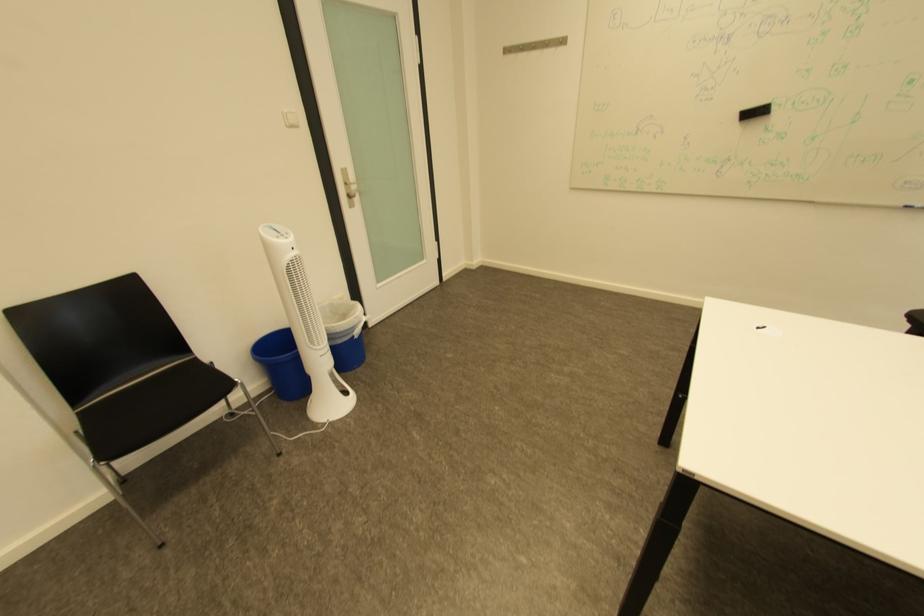
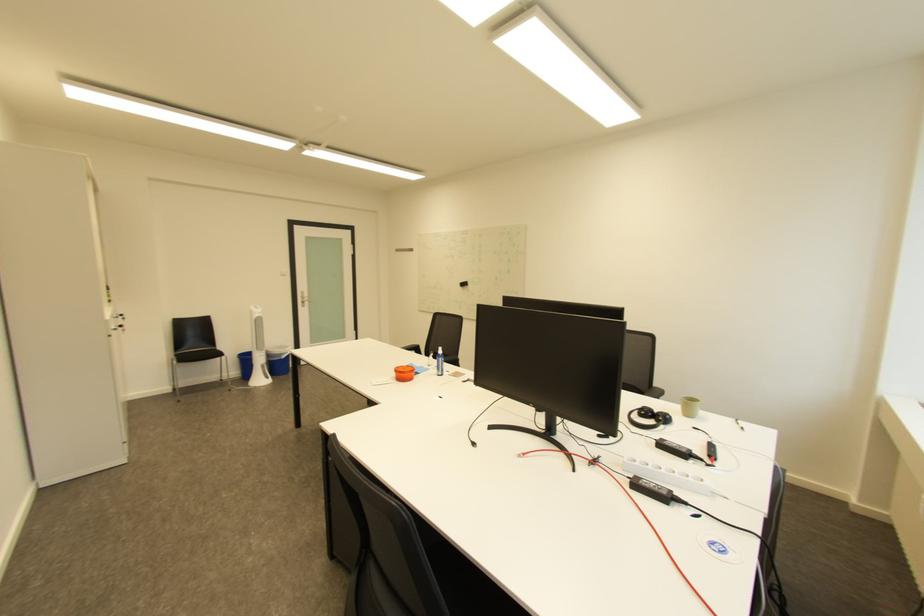
The point at (x=341, y=376) is marked in the first image. Where is the corresponding point in the second image?

(273, 367)